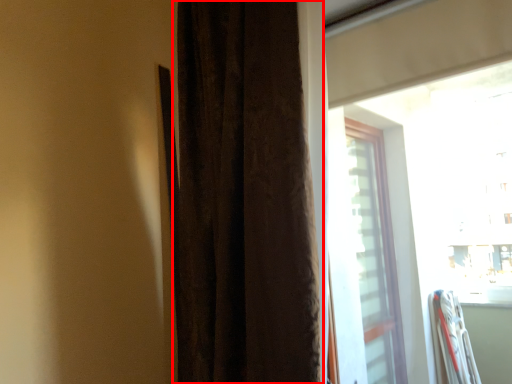
Question: Considering the relative positions of curtain (annotated by the red box) and window in the image provided, where is curtain (annotated by the red box) located with respect to the staircase?

Choices:
 (A) left
 (B) right

Answer: (A)